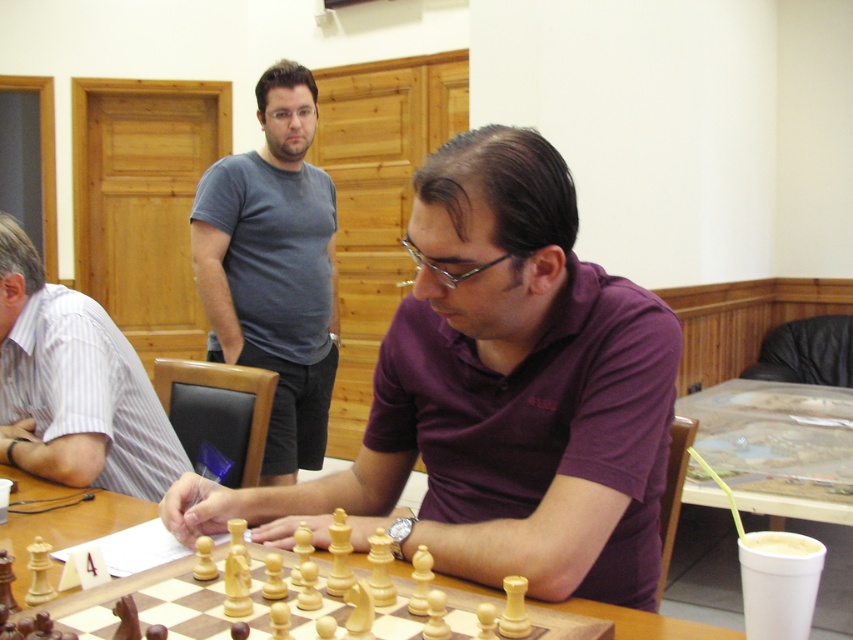
Based on the photo, how much distance is there between gray cotton t-shirt at upper center and white striped shirt at left?

A distance of 74.83 centimeters exists between gray cotton t-shirt at upper center and white striped shirt at left.

Does gray cotton t-shirt at upper center come behind white striped shirt at left?

Yes, gray cotton t-shirt at upper center is further from the viewer.

Is point (296, 348) positioned after point (103, 336)?

That is True.

Locate an element on the screen. This screenshot has width=853, height=640. gray cotton t-shirt at upper center is located at coordinates (274, 268).

Is purple cotton shirt at center shorter than wooden chessboard at center?

No, purple cotton shirt at center is not shorter than wooden chessboard at center.

Which is behind, point (630, 500) or point (608, 604)?

The point (630, 500) is more distant.

Describe the element at coordinates (498, 396) in the screenshot. I see `purple cotton shirt at center` at that location.

Locate an element on the screen. Image resolution: width=853 pixels, height=640 pixels. purple cotton shirt at center is located at coordinates 498,396.

Does point (479, 285) come behind point (199, 266)?

No, it is not.

Is purple cotton shirt at center shorter than gray cotton t-shirt at upper center?

Yes.

What do you see at coordinates (498, 396) in the screenshot? I see `purple cotton shirt at center` at bounding box center [498, 396].

I want to click on purple cotton shirt at center, so click(498, 396).